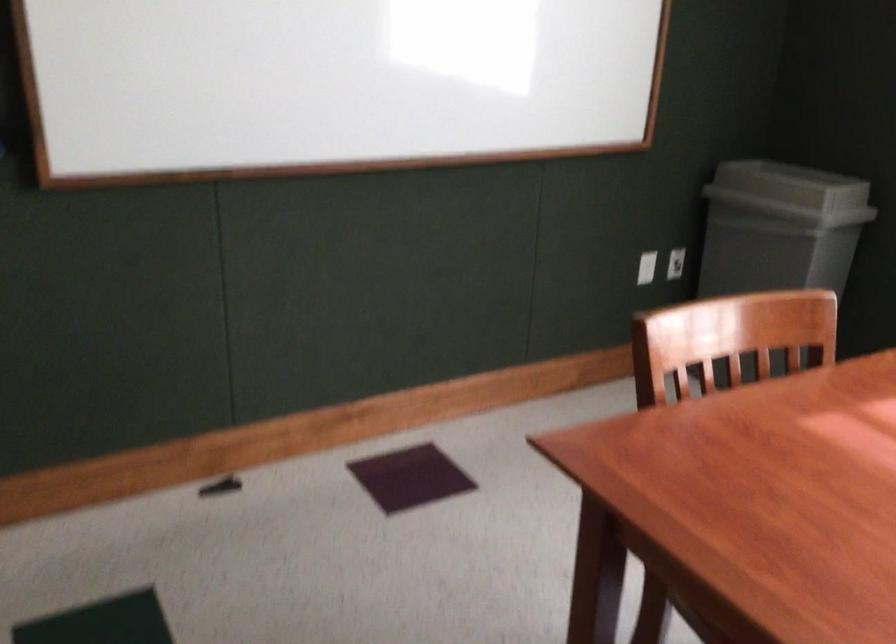
Describe the element at coordinates (675, 263) in the screenshot. I see `the white light switch` at that location.